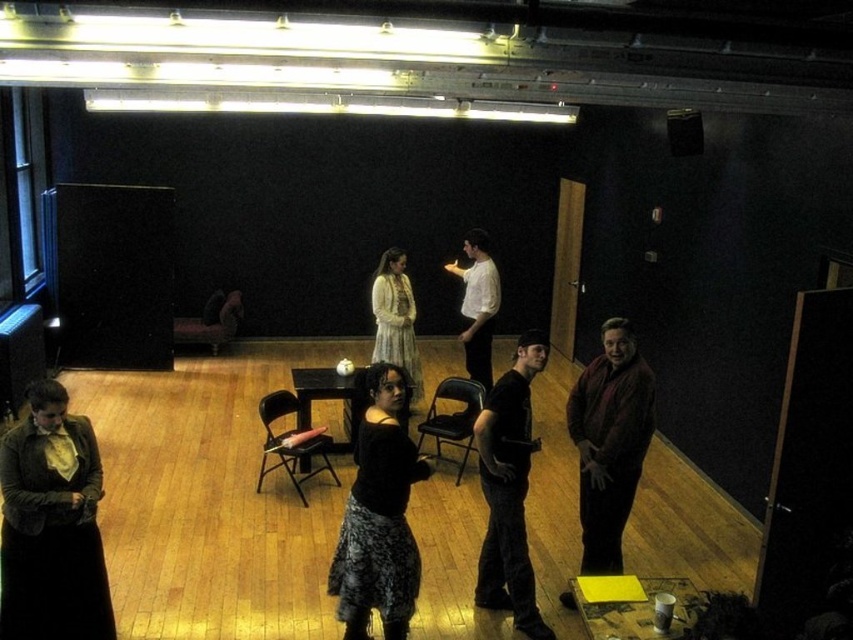
You are standing in the rehearsal space and see two points marked in the scene. The first point is at coordinate point [592,531] and the second is at point [508,385]. Which point is closer to you?

Point [508,385] is closer to you because it is less far from the camera than point [592,531].

You are an assistant organizing a costume storage room. You have two items to place on a shelf that can only hold items smaller than the maroon wool sweater at center. Can the matte brown jacket at lower left be placed there?

The matte brown jacket at lower left is smaller than the maroon wool sweater at center, so it can be placed on the shelf since it meets the size requirement.

You are an observer standing at the back of the rehearsal space. You see the matte brown jacket at lower left and the maroon wool sweater at center. Which clothing item is positioned lower in the image?

The matte brown jacket at lower left is located below the maroon wool sweater at center, so it is positioned lower in the image.